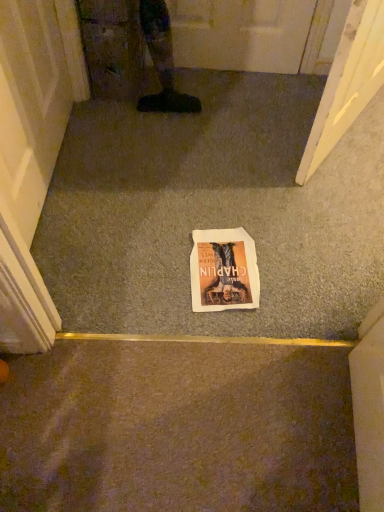
Identify the location of free space to the back side of white paper comic book at center. (216, 201).